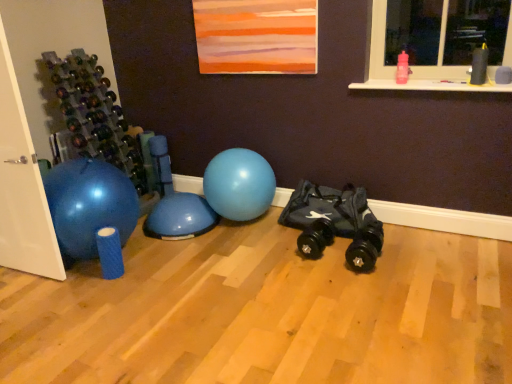
Question: Is blue rubber ball at center smaller than pink plastic water bottle at upper right?

Choices:
 (A) no
 (B) yes

Answer: (A)

Question: Is blue rubber ball at center closer to camera compared to pink plastic water bottle at upper right?

Choices:
 (A) yes
 (B) no

Answer: (B)

Question: Is blue rubber ball at center far away from pink plastic water bottle at upper right?

Choices:
 (A) yes
 (B) no

Answer: (A)

Question: Is blue rubber ball at center wider than pink plastic water bottle at upper right?

Choices:
 (A) yes
 (B) no

Answer: (A)

Question: Is blue rubber ball at center facing towards pink plastic water bottle at upper right?

Choices:
 (A) no
 (B) yes

Answer: (A)

Question: Is blue rubber ball at center shorter than pink plastic water bottle at upper right?

Choices:
 (A) no
 (B) yes

Answer: (A)

Question: Can you confirm if blue rubber ball at center is positioned to the right of black rubber toy car at center?

Choices:
 (A) no
 (B) yes

Answer: (A)

Question: Are blue rubber ball at center and black rubber toy car at center located far from each other?

Choices:
 (A) no
 (B) yes

Answer: (A)

Question: Considering the relative sizes of blue rubber ball at center and black rubber toy car at center in the image provided, is blue rubber ball at center taller than black rubber toy car at center?

Choices:
 (A) no
 (B) yes

Answer: (B)

Question: Is blue rubber ball at center outside black rubber toy car at center?

Choices:
 (A) yes
 (B) no

Answer: (A)

Question: From the image's perspective, is blue rubber ball at center on top of black rubber toy car at center?

Choices:
 (A) yes
 (B) no

Answer: (A)

Question: Is blue rubber ball at center oriented towards black rubber toy car at center?

Choices:
 (A) no
 (B) yes

Answer: (A)

Question: Is pink plastic water bottle at upper right further to camera compared to black rubber toy car at center?

Choices:
 (A) no
 (B) yes

Answer: (A)